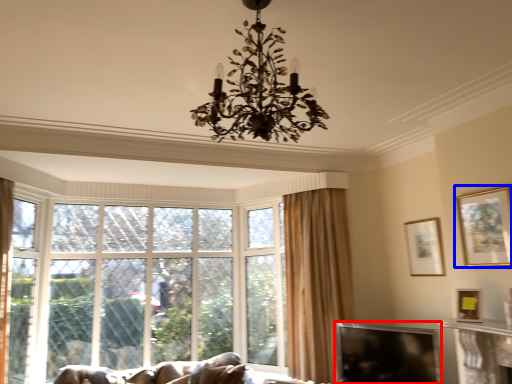
Question: Which point is closer to the camera, window screen (highlighted by a red box) or picture frame (highlighted by a blue box)?

Choices:
 (A) window screen
 (B) picture frame

Answer: (B)